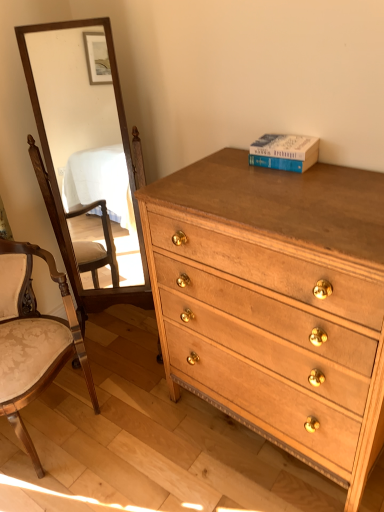
Question: From the image's perspective, is wooden mirror at left over wooden upholstered chair at left?

Choices:
 (A) no
 (B) yes

Answer: (B)

Question: Is there a large distance between wooden mirror at left and wooden upholstered chair at left?

Choices:
 (A) no
 (B) yes

Answer: (B)

Question: Would you say wooden mirror at left contains wooden upholstered chair at left?

Choices:
 (A) yes
 (B) no

Answer: (B)

Question: Does wooden mirror at left have a greater width compared to wooden upholstered chair at left?

Choices:
 (A) yes
 (B) no

Answer: (B)

Question: Can you confirm if wooden mirror at left is shorter than wooden upholstered chair at left?

Choices:
 (A) no
 (B) yes

Answer: (A)

Question: Considering the relative sizes of wooden mirror at left and wooden upholstered chair at left in the image provided, is wooden mirror at left taller than wooden upholstered chair at left?

Choices:
 (A) no
 (B) yes

Answer: (B)

Question: Can you confirm if blue hardcover book at upper right is wider than wooden mirror at left?

Choices:
 (A) no
 (B) yes

Answer: (A)

Question: From a real-world perspective, is blue hardcover book at upper right on top of wooden mirror at left?

Choices:
 (A) yes
 (B) no

Answer: (A)

Question: From the image's perspective, is blue hardcover book at upper right located above wooden mirror at left?

Choices:
 (A) yes
 (B) no

Answer: (A)

Question: Is blue hardcover book at upper right aimed at wooden mirror at left?

Choices:
 (A) yes
 (B) no

Answer: (B)

Question: Considering the relative sizes of blue hardcover book at upper right and wooden mirror at left in the image provided, is blue hardcover book at upper right taller than wooden mirror at left?

Choices:
 (A) no
 (B) yes

Answer: (A)

Question: Are blue hardcover book at upper right and wooden mirror at left far apart?

Choices:
 (A) yes
 (B) no

Answer: (A)

Question: Considering the relative sizes of wooden upholstered chair at left and blue hardcover book at upper right in the image provided, is wooden upholstered chair at left smaller than blue hardcover book at upper right?

Choices:
 (A) no
 (B) yes

Answer: (A)